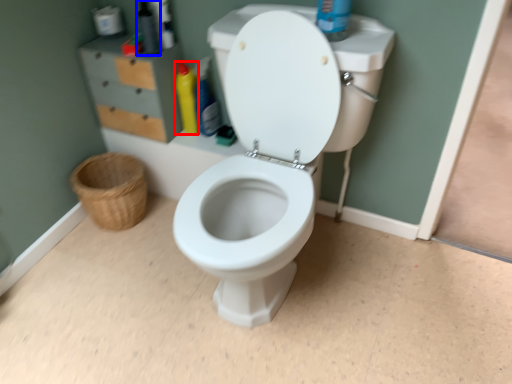
Question: Which point is further to the camera, cleaning product (highlighted by a red box) or toiletry (highlighted by a blue box)?

Choices:
 (A) cleaning product
 (B) toiletry

Answer: (A)